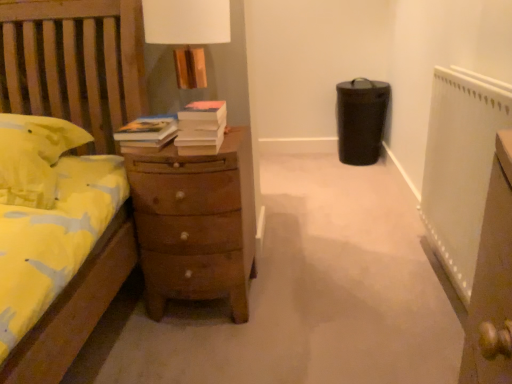
Question: Does brown wooden chest of drawers at center have a lesser width compared to white textured radiator at right?

Choices:
 (A) no
 (B) yes

Answer: (A)

Question: Does brown wooden chest of drawers at center appear on the left side of white textured radiator at right?

Choices:
 (A) yes
 (B) no

Answer: (A)

Question: Can you confirm if brown wooden chest of drawers at center is taller than white textured radiator at right?

Choices:
 (A) no
 (B) yes

Answer: (A)

Question: Can you confirm if brown wooden chest of drawers at center is positioned to the right of white textured radiator at right?

Choices:
 (A) yes
 (B) no

Answer: (B)

Question: From a real-world perspective, is brown wooden chest of drawers at center positioned under white textured radiator at right based on gravity?

Choices:
 (A) no
 (B) yes

Answer: (B)

Question: From the image's perspective, is white matte book at center above or below brown wooden chest of drawers at center?

Choices:
 (A) below
 (B) above

Answer: (B)

Question: In terms of size, does white matte book at center appear bigger or smaller than brown wooden chest of drawers at center?

Choices:
 (A) big
 (B) small

Answer: (B)

Question: Considering the positions of point (189, 130) and point (138, 168), is point (189, 130) closer or farther from the camera than point (138, 168)?

Choices:
 (A) closer
 (B) farther

Answer: (A)

Question: From a real-world perspective, is white matte book at center positioned above or below brown wooden chest of drawers at center?

Choices:
 (A) above
 (B) below

Answer: (A)

Question: From the image's perspective, is brown wooden chest of drawers at center located above or below white matte book at center?

Choices:
 (A) below
 (B) above

Answer: (A)

Question: From a real-world perspective, is brown wooden chest of drawers at center physically located above or below white matte book at center?

Choices:
 (A) above
 (B) below

Answer: (B)

Question: In terms of height, does brown wooden chest of drawers at center look taller or shorter compared to white matte book at center?

Choices:
 (A) short
 (B) tall

Answer: (B)

Question: Considering the positions of brown wooden chest of drawers at center and white matte book at center in the image, is brown wooden chest of drawers at center wider or thinner than white matte book at center?

Choices:
 (A) thin
 (B) wide

Answer: (B)

Question: Is white textured radiator at right bigger or smaller than brown wooden chest of drawers at center?

Choices:
 (A) big
 (B) small

Answer: (B)

Question: Relative to brown wooden chest of drawers at center, is white textured radiator at right in front or behind?

Choices:
 (A) behind
 (B) front

Answer: (B)